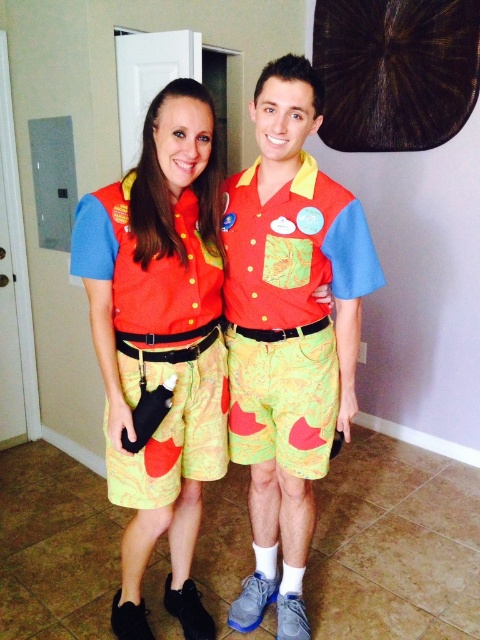
Question: Can you confirm if matte polyester shorts at center is bigger than matte polyester vest at center?

Choices:
 (A) yes
 (B) no

Answer: (A)

Question: Which object is the farthest from the matte polyester shorts at center?

Choices:
 (A) matte fabric shirt at center
 (B) matte polyester vest at center

Answer: (A)

Question: Is matte polyester shorts at center behind matte polyester vest at center?

Choices:
 (A) no
 (B) yes

Answer: (B)

Question: Which is farther from the matte polyester shorts at center?

Choices:
 (A) matte fabric shirt at center
 (B) matte polyester vest at center

Answer: (A)

Question: Among these objects, which one is farthest from the camera?

Choices:
 (A) matte polyester shorts at center
 (B) matte fabric shirt at center
 (C) matte polyester vest at center

Answer: (B)

Question: Can you confirm if matte polyester shorts at center is wider than matte fabric shirt at center?

Choices:
 (A) yes
 (B) no

Answer: (A)